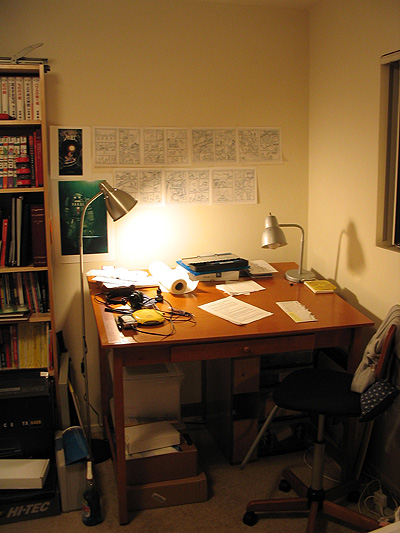
Locate an element on the screen. drawer is located at coordinates (201, 358).